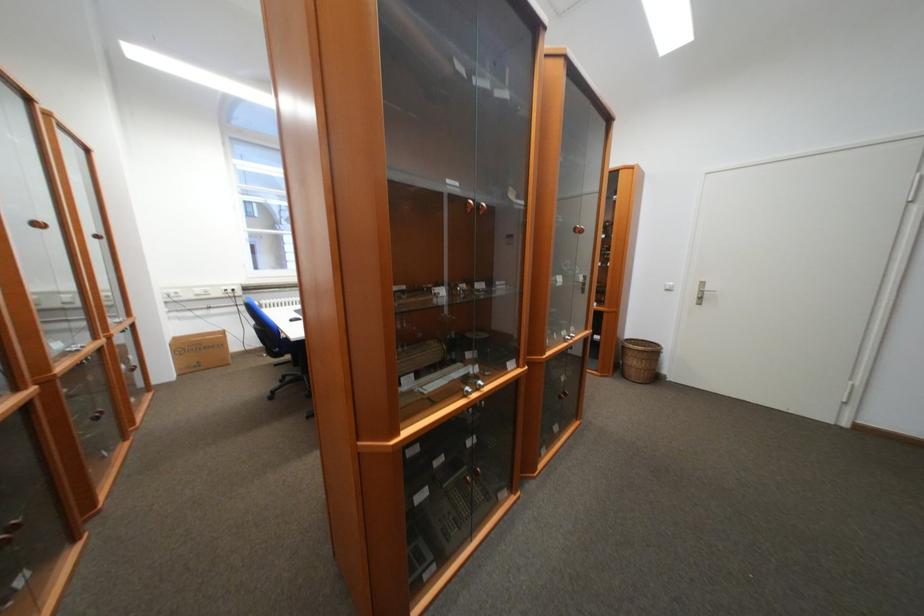
Describe the element at coordinates (639, 360) in the screenshot. I see `the wicker waste basket` at that location.